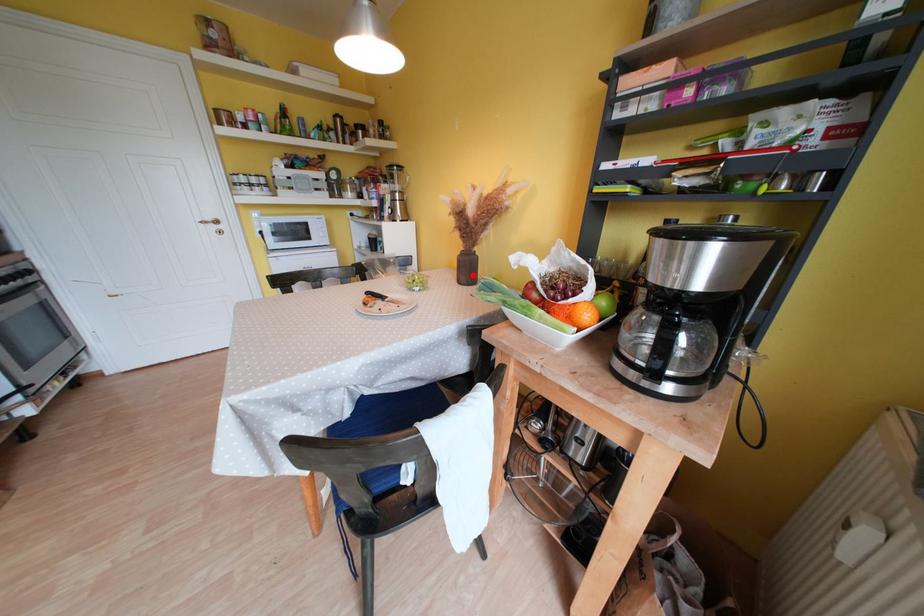
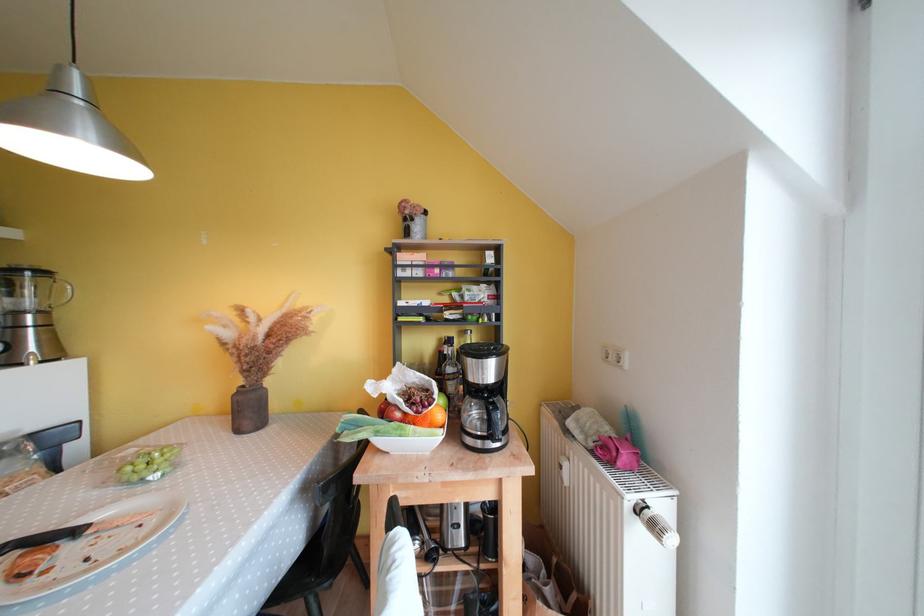
Question: I am providing you with two images of the same scene from different viewpoints. A red point is marked on the first image. Can you still see the location of the red point in image 2?

Choices:
 (A) Yes
 (B) No

Answer: (A)